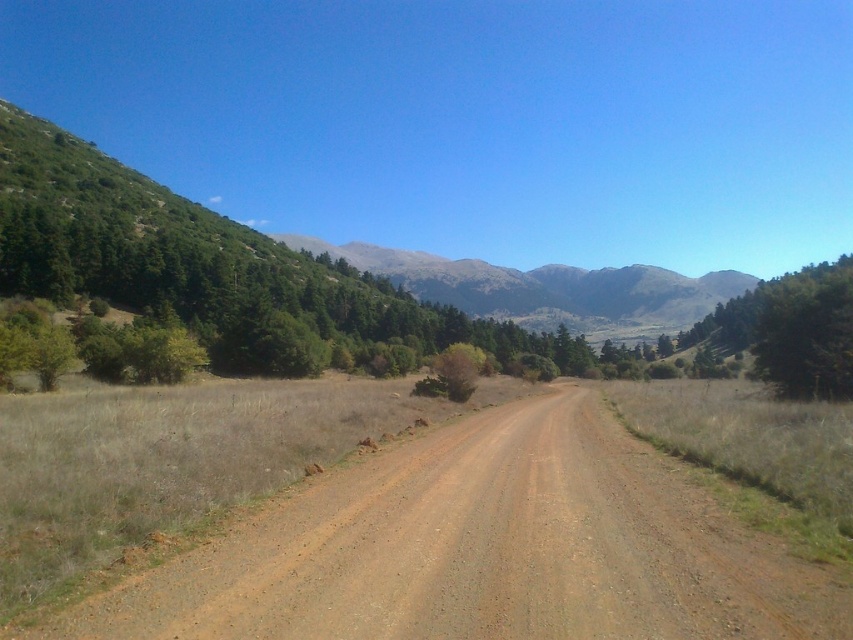
Does point (166, 618) come in front of point (648, 305)?

Yes, point (166, 618) is in front of point (648, 305).

Is brown gravel road at center taller than green forested mountain at center?

No, brown gravel road at center is not taller than green forested mountain at center.

Does point (679, 611) come in front of point (335, 256)?

Yes, it is.

What are the coordinates of `brown gravel road at center` in the screenshot? It's located at (483, 548).

In the scene shown: Can you confirm if brown gravel road at center is positioned below green forested mountain at upper left?

Indeed, brown gravel road at center is positioned under green forested mountain at upper left.

Image resolution: width=853 pixels, height=640 pixels. Identify the location of brown gravel road at center. (483, 548).

Does point (325, 497) come behind point (669, 298)?

No, (325, 497) is closer to viewer.

Where is `brown gravel road at center`? The image size is (853, 640). brown gravel road at center is located at coordinates (483, 548).

At what (x,y) coordinates should I click in order to perform the action: click on green forested mountain at upper left. Please return your answer as a coordinate pair (x, y). The height and width of the screenshot is (640, 853). Looking at the image, I should click on (457, 264).

Does green forested mountain at upper left appear under green forested mountain at center?

Incorrect, green forested mountain at upper left is not positioned below green forested mountain at center.

Between point (440, 259) and point (490, 280), which one is positioned in front?

Point (490, 280)

This screenshot has height=640, width=853. I want to click on green forested mountain at upper left, so pos(457,264).